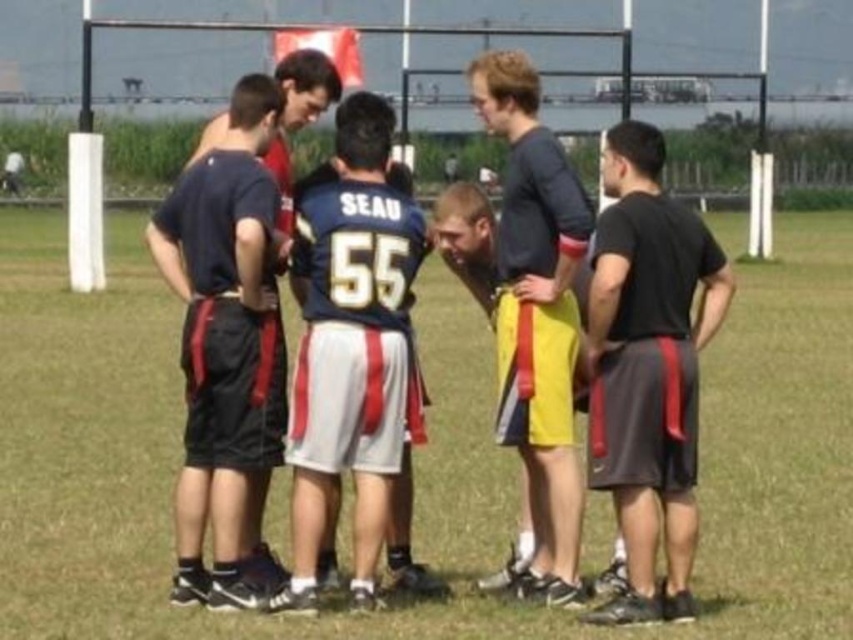
Is point (675, 436) closer to viewer compared to point (222, 192)?

Yes, it is in front of point (222, 192).

Is black matte shorts at right thinner than matte black shorts at left?

Incorrect, black matte shorts at right's width is not less than matte black shorts at left's.

Is point (648, 602) behind point (225, 321)?

No.

In order to click on black matte shorts at right in this screenshot , I will do `click(648, 369)`.

Who is more distant from viewer, (x=541, y=340) or (x=279, y=68)?

Point (x=279, y=68)

Does yellow fabric shorts at center have a smaller size compared to matte black shirt at center?

Correct, yellow fabric shorts at center occupies less space than matte black shirt at center.

Where is `yellow fabric shorts at center`? yellow fabric shorts at center is located at coordinates (532, 300).

The width and height of the screenshot is (853, 640). I want to click on yellow fabric shorts at center, so click(532, 300).

What do you see at coordinates (537, 314) in the screenshot? This screenshot has height=640, width=853. I see `matte blue shirt at center` at bounding box center [537, 314].

Between point (567, 570) and point (260, 321), which one is positioned in front?

Point (260, 321)

The height and width of the screenshot is (640, 853). Describe the element at coordinates (537, 314) in the screenshot. I see `matte blue shirt at center` at that location.

The image size is (853, 640). In order to click on matte blue shirt at center in this screenshot , I will do `click(537, 314)`.